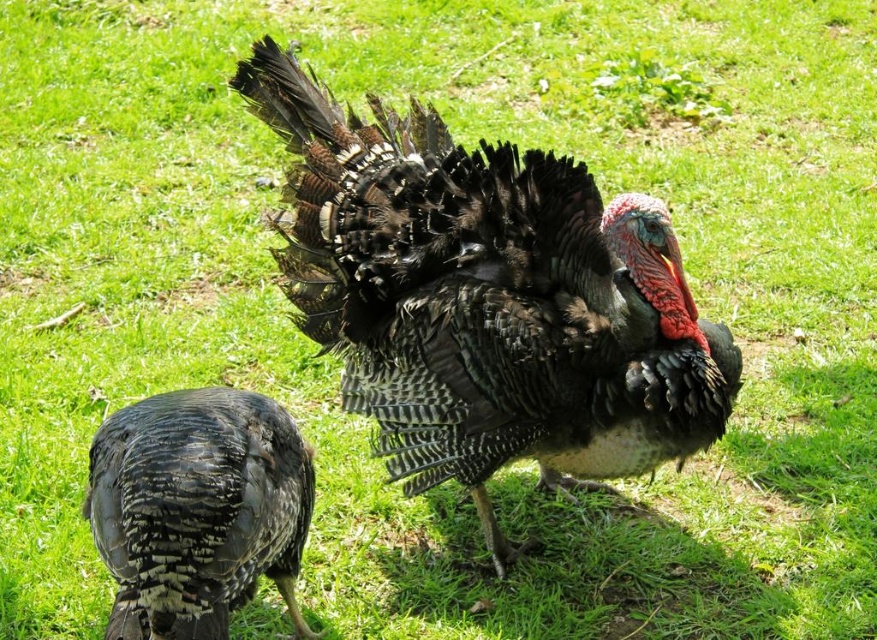
You are a photographer trying to capture a clear shot of the shiny black turkey at center and the shiny black feathers at lower left. Since you want both subjects in focus, which one should you adjust your camera focus to prioritize based on their positions?

The shiny black turkey at center is located above the shiny black feathers at lower left, so you should prioritize focusing on the shiny black turkey at center first since it is closer to the camera.

You are a wildlife photographer aiming to capture a closeup shot of the shiny black turkey at center and the shiny black feathers at lower left. Given that your camera can only focus on objects wider than 10 cm, can both subjects fit within the camera frame?

The shiny black turkey at center has a larger width than the shiny black feathers at lower left. Since the turkey is wider than 10 cm, it can be captured. However, the shiny black feathers at lower left might be narrower than 10 cm, so they may not fit within the camera frame.